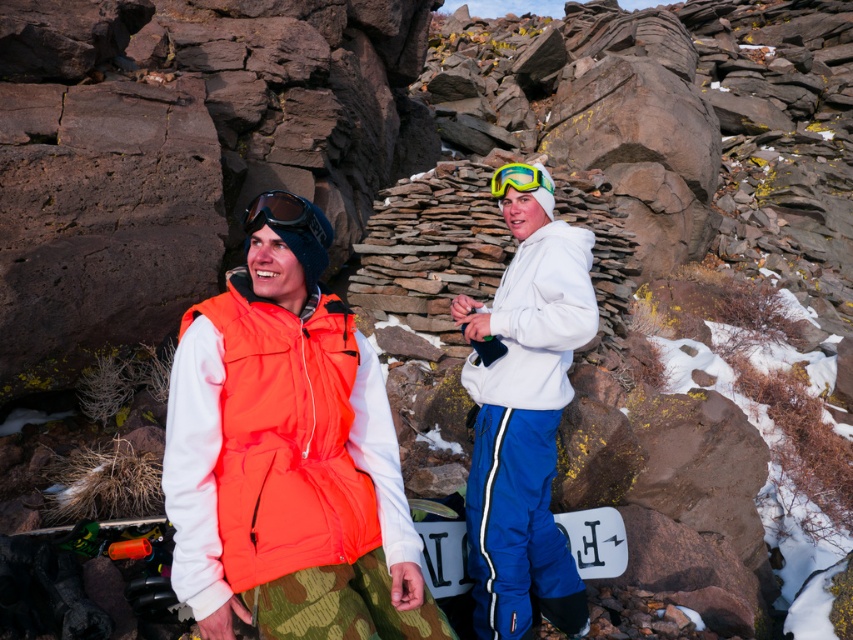
Who is shorter, neon orange softshell vest at center or matte blue goggles at center?

matte blue goggles at center

Is neon orange softshell vest at center smaller than matte blue goggles at center?

No.

Is point (242, 458) farther from camera compared to point (314, 218)?

No, (242, 458) is in front of (314, 218).

Image resolution: width=853 pixels, height=640 pixels. Find the location of `neon orange softshell vest at center`. neon orange softshell vest at center is located at coordinates (288, 461).

Between point (305, 432) and point (544, 184), which one is positioned behind?

The point (544, 184) is more distant.

Between point (374, 560) and point (512, 172), which one is positioned in front?

Point (374, 560) is more forward.

Locate an element on the screen. This screenshot has height=640, width=853. neon orange softshell vest at center is located at coordinates (288, 461).

Image resolution: width=853 pixels, height=640 pixels. What are the coordinates of `neon orange softshell vest at center` in the screenshot? It's located at (288, 461).

Does point (310, 224) come in front of point (514, 164)?

Yes, point (310, 224) is in front of point (514, 164).

Is point (271, 220) positioned in front of point (548, 180)?

Yes.

Where is `matte blue goggles at center`? matte blue goggles at center is located at coordinates (281, 214).